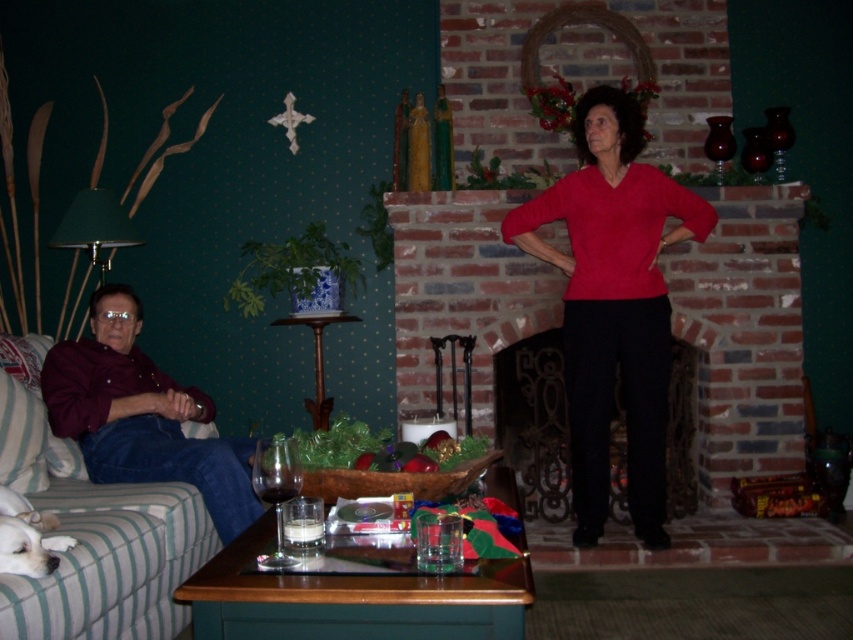
Question: Is the position of brick fireplace at center less distant than that of matte red sweater at center?

Choices:
 (A) yes
 (B) no

Answer: (B)

Question: Can you confirm if matte red sweater at center is positioned to the right of maroon shirt at left?

Choices:
 (A) no
 (B) yes

Answer: (B)

Question: Which of the following is the farthest from the observer?

Choices:
 (A) brick fireplace at center
 (B) maroon shirt at left
 (C) green striped fabric couch at left

Answer: (A)

Question: Which object appears closest to the camera in this image?

Choices:
 (A) brick fireplace at center
 (B) green striped fabric couch at left

Answer: (B)

Question: Can you confirm if green striped fabric couch at left is positioned above maroon shirt at left?

Choices:
 (A) yes
 (B) no

Answer: (B)

Question: Among these points, which one is nearest to the camera?

Choices:
 (A) (489, 298)
 (B) (189, 513)
 (C) (573, 276)
 (D) (165, 433)

Answer: (B)